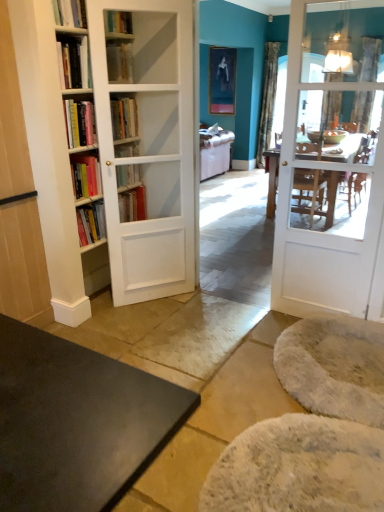
I want to click on vacant space situated on the left part of white fluffy yoga mat at lower right, the second yoga mat positioned from the front, so click(214, 364).